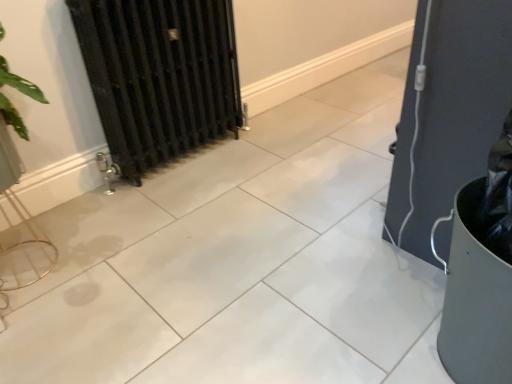
Where is `blank area to the left of matte black guitar case at right`? Image resolution: width=512 pixels, height=384 pixels. blank area to the left of matte black guitar case at right is located at coordinates (351, 209).